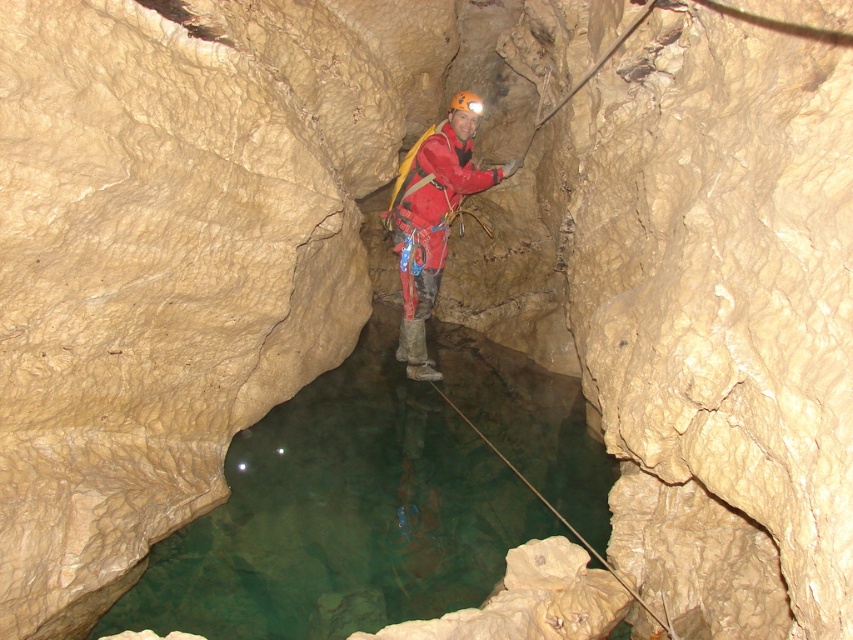
In the scene shown: You are a caver planning to cross the narrow cave passage. You see the clear water at center and the red matte jacket at center. Which object is wider in this scene?

The clear water at center is wider than the red matte jacket at center.

You are a caver preparing to descend into a narrow cave passage. You see the clear water at center and the red matte jacket at center. Which object is positioned lower in the scene?

The clear water at center is located below the red matte jacket at center, so the clear water at center is positioned lower in the scene.

You are navigating through a narrow cave passage and see two points marked on your map. The first point is at coordinate point (415, 456) and the second point is at coordinate point (434, 369). If you are facing the direction of the cave passage, which point is closer to you?

Point (415, 456) is in front of point (434, 369), so the point closer to you would be point (415, 456).